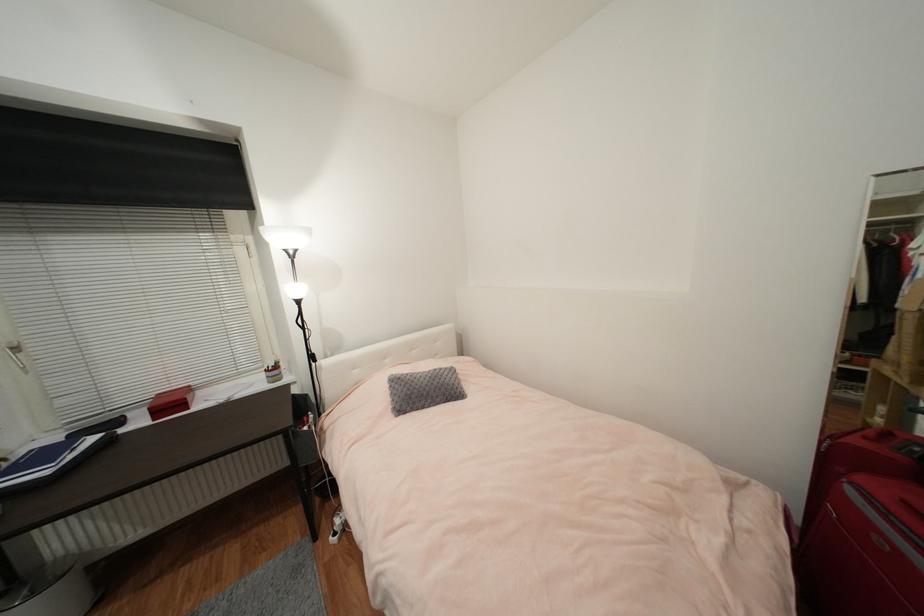
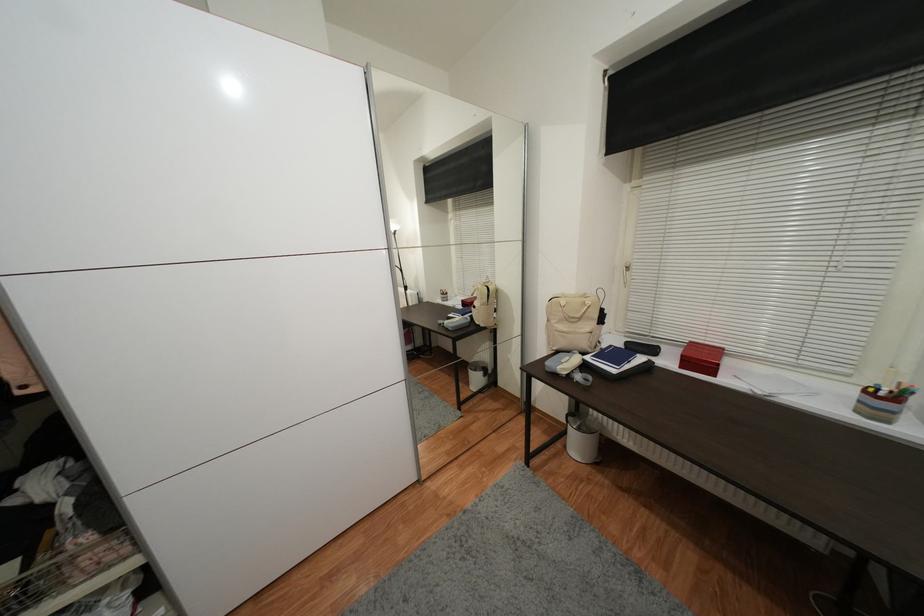
Find the pixel in the second image that matches the point at 176,405 in the first image.

(706, 361)